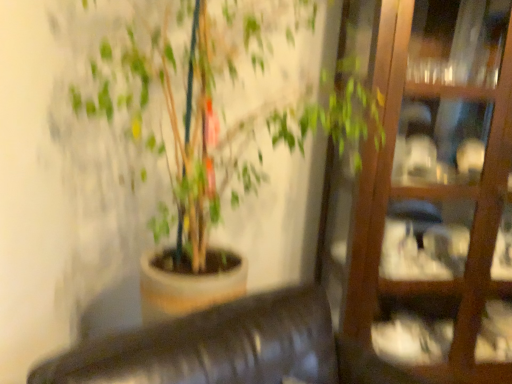
The image size is (512, 384). Describe the element at coordinates (430, 199) in the screenshot. I see `wooden glass door at right` at that location.

Locate an element on the screen. wooden glass door at right is located at coordinates (430, 199).

Describe the element at coordinates (176, 119) in the screenshot. I see `matte brown pot at center` at that location.

The height and width of the screenshot is (384, 512). In order to click on matte brown pot at center in this screenshot , I will do `click(176, 119)`.

You are a GUI agent. You are given a task and a screenshot of the screen. Output one action in this format:
    pyautogui.click(x=<x>, y=<y>)
    Task: Click on the wooden glass door at right
    This screenshot has height=384, width=512.
    Given the screenshot: What is the action you would take?
    pyautogui.click(x=430, y=199)

Which object is positioned more to the left, wooden glass door at right or matte brown pot at center?

matte brown pot at center is more to the left.

Based on the photo, in the image, is wooden glass door at right positioned in front of or behind matte brown pot at center?

wooden glass door at right is behind matte brown pot at center.

Which point is more distant from viewer, (380,21) or (231,90)?

The point (231,90) is farther from the camera.

From the image's perspective, is wooden glass door at right above or below matte brown pot at center?

From the image's perspective, wooden glass door at right appears below matte brown pot at center.

From a real-world perspective, is wooden glass door at right positioned over matte brown pot at center based on gravity?

No, from a real-world perspective, wooden glass door at right is not on top of matte brown pot at center.

Can you confirm if wooden glass door at right is thinner than matte brown pot at center?

Indeed, wooden glass door at right has a lesser width compared to matte brown pot at center.

Consider the image. In terms of height, does wooden glass door at right look taller or shorter compared to matte brown pot at center?

wooden glass door at right is taller than matte brown pot at center.

Does wooden glass door at right have a smaller size compared to matte brown pot at center?

Yes, wooden glass door at right is smaller than matte brown pot at center.

Would you say wooden glass door at right is inside or outside matte brown pot at center?

wooden glass door at right cannot be found inside matte brown pot at center.

Based on the photo, is wooden glass door at right directly adjacent to matte brown pot at center?

No, wooden glass door at right is not with matte brown pot at center.

Is wooden glass door at right turned away from matte brown pot at center?

No, matte brown pot at center is not at the back of wooden glass door at right.

How different are the orientations of wooden glass door at right and matte brown pot at center in degrees?

The angle between the facing direction of wooden glass door at right and the facing direction of matte brown pot at center is 1.26 degrees.

The image size is (512, 384). I want to click on houseplant above the wooden glass door at right (from a real-world perspective), so click(176, 119).

Which object is positioned more to the left, matte brown pot at center or wooden glass door at right?

Positioned to the left is matte brown pot at center.

Which object is closer to the camera, matte brown pot at center or wooden glass door at right?

matte brown pot at center.

Is point (188, 149) closer or farther from the camera than point (376, 234)?

Point (188, 149).

From the image's perspective, would you say matte brown pot at center is positioned over wooden glass door at right?

Correct, matte brown pot at center appears higher than wooden glass door at right in the image.

From a real-world perspective, between matte brown pot at center and wooden glass door at right, who is vertically lower?

wooden glass door at right, from a real-world perspective.

Does matte brown pot at center have a lesser width compared to wooden glass door at right?

No.

In terms of height, does matte brown pot at center look taller or shorter compared to wooden glass door at right?

matte brown pot at center is shorter than wooden glass door at right.

Based on the photo, between matte brown pot at center and wooden glass door at right, which one has larger size?

With larger size is matte brown pot at center.

Would you say matte brown pot at center is outside wooden glass door at right?

Indeed, matte brown pot at center is completely outside wooden glass door at right.

Would you consider matte brown pot at center to be distant from wooden glass door at right?

No, there isn't a large distance between matte brown pot at center and wooden glass door at right.

Could you tell me if matte brown pot at center is turned towards wooden glass door at right?

No, matte brown pot at center is not facing towards wooden glass door at right.

This screenshot has width=512, height=384. Identify the location of glass door on the right of the matte brown pot at center. (430, 199).

This screenshot has width=512, height=384. In order to click on glass door on the right side of matte brown pot at center in this screenshot , I will do `click(430, 199)`.

Identify the location of houseplant on the left of wooden glass door at right. [x=176, y=119].